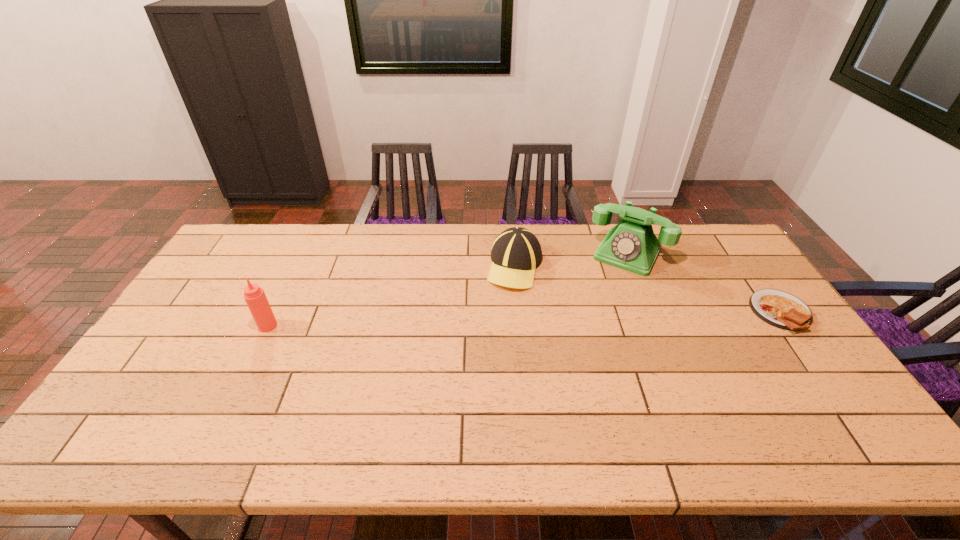
Identify the location of unoccupied position between the telephone and the baseball cap. The image size is (960, 540). (571, 260).

The height and width of the screenshot is (540, 960). What are the coordinates of `vacant point located between the telephone and the shortest object` in the screenshot? It's located at (704, 283).

At what (x,y) coordinates should I click in order to perform the action: click on free area in between the second object from left to right and the telephone. Please return your answer as a coordinate pair (x, y). The width and height of the screenshot is (960, 540). Looking at the image, I should click on (571, 260).

Image resolution: width=960 pixels, height=540 pixels. In order to click on object that ranks as the second closest to the baseball cap in this screenshot , I will do (x=780, y=309).

You are a GUI agent. You are given a task and a screenshot of the screen. Output one action in this format:
    pyautogui.click(x=<x>, y=<y>)
    Task: Click on the third closest object to the rightmost object
    The image size is (960, 540).
    Given the screenshot: What is the action you would take?
    pyautogui.click(x=256, y=300)